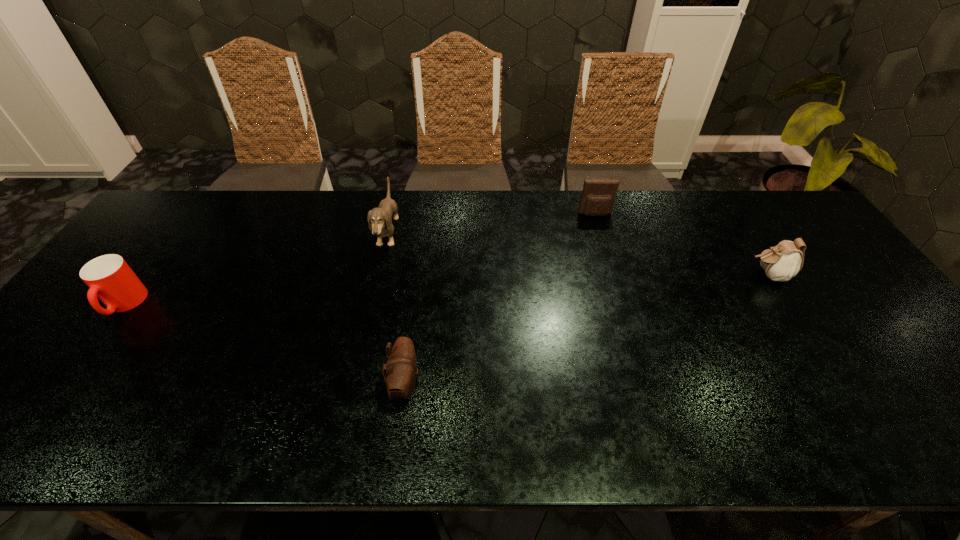
Where is `the second object from left to right`? the second object from left to right is located at coordinates (381, 218).

Where is `the rightmost object`? the rightmost object is located at coordinates (782, 262).

Identify the location of the second nearest pouch. Image resolution: width=960 pixels, height=540 pixels. (782, 262).

The width and height of the screenshot is (960, 540). Identify the location of the farthest pouch. [598, 196].

This screenshot has height=540, width=960. Find the location of `the second object from right to left`. the second object from right to left is located at coordinates (598, 196).

This screenshot has height=540, width=960. In order to click on cup in this screenshot , I will do `click(109, 277)`.

Locate an element on the screen. This screenshot has width=960, height=540. the nearest object is located at coordinates tap(401, 368).

In order to click on the leftmost pouch in this screenshot , I will do `click(401, 368)`.

Identify the location of free region located at the face of the puppy. (468, 234).

The height and width of the screenshot is (540, 960). Identify the location of vacant space located 0.320m on the front-facing side of the rightmost pouch. (636, 275).